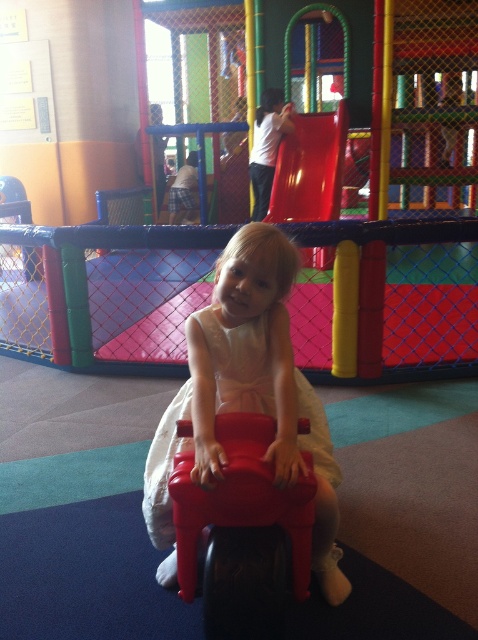
Question: Observing the image, what is the correct spatial positioning of rubberized red toy car at center in reference to shiny plastic slide at upper center?

Choices:
 (A) left
 (B) right

Answer: (A)

Question: Which object appears farthest from the camera in this image?

Choices:
 (A) shiny plastic slide at upper center
 (B) white satin dress at center
 (C) rubberized red toy car at center

Answer: (A)

Question: Can you confirm if rubberized red toy car at center is positioned to the left of white satin dress at center?

Choices:
 (A) yes
 (B) no

Answer: (A)

Question: Which of these objects is positioned closest to the shiny plastic slide at upper center?

Choices:
 (A) white satin dress at center
 (B) rubberized red toy car at center

Answer: (A)

Question: Observing the image, what is the correct spatial positioning of rubberized red toy car at center in reference to shiny plastic slide at upper center?

Choices:
 (A) left
 (B) right

Answer: (A)

Question: Which is farther from the rubberized red toy car at center?

Choices:
 (A) shiny plastic slide at upper center
 (B) white satin dress at center

Answer: (A)